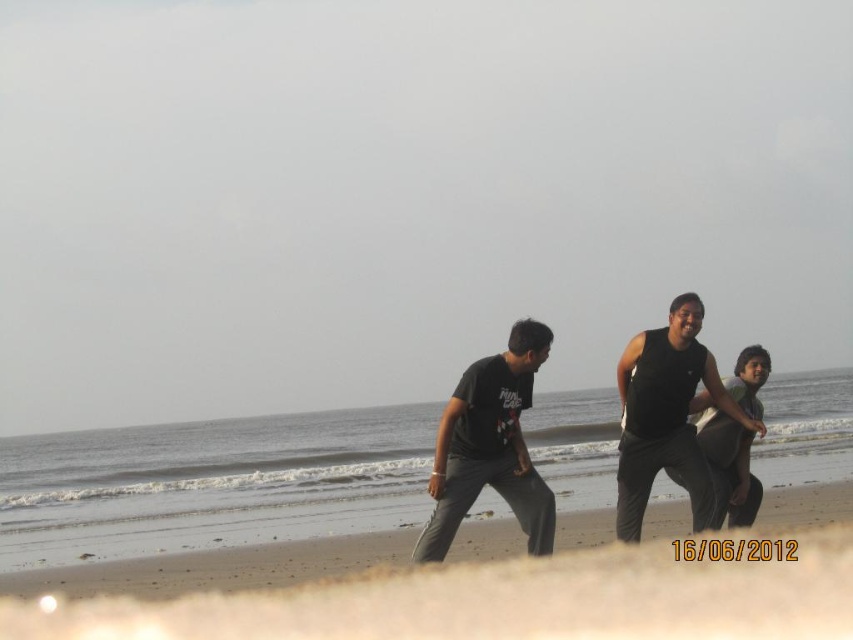
You are standing on the beach and see the brown sandy beach at lower center and the dark gray jeans at center. Which object is positioned to the left of the other?

The brown sandy beach at lower center is to the left of dark gray jeans at center.